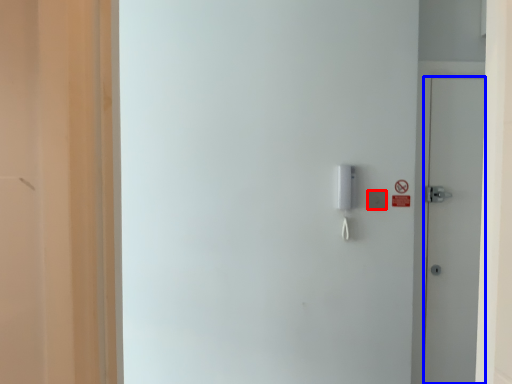
Question: Which of the following is the farthest to the observer, light switch (highlighted by a red box) or door (highlighted by a blue box)?

Choices:
 (A) light switch
 (B) door

Answer: (B)